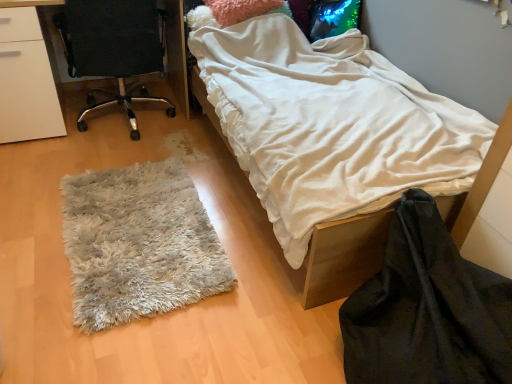
Question: Does white soft blanket at center appear on the right side of black velvet blanket at lower right?

Choices:
 (A) no
 (B) yes

Answer: (A)

Question: Is black velvet blanket at lower right completely or partially inside white soft blanket at center?

Choices:
 (A) no
 (B) yes

Answer: (A)

Question: Does white soft blanket at center have a lesser width compared to black velvet blanket at lower right?

Choices:
 (A) yes
 (B) no

Answer: (B)

Question: Is white soft blanket at center oriented away from black velvet blanket at lower right?

Choices:
 (A) yes
 (B) no

Answer: (B)

Question: Is white soft blanket at center taller than black velvet blanket at lower right?

Choices:
 (A) yes
 (B) no

Answer: (A)

Question: From a real-world perspective, is white soft blanket at center under black velvet blanket at lower right?

Choices:
 (A) yes
 (B) no

Answer: (B)

Question: Is white fluffy rug at lower left oriented away from white soft blanket at center?

Choices:
 (A) no
 (B) yes

Answer: (B)

Question: From the image's perspective, is white fluffy rug at lower left over white soft blanket at center?

Choices:
 (A) no
 (B) yes

Answer: (A)

Question: Can you confirm if white fluffy rug at lower left is bigger than white soft blanket at center?

Choices:
 (A) no
 (B) yes

Answer: (A)

Question: Considering the relative sizes of white fluffy rug at lower left and white soft blanket at center in the image provided, is white fluffy rug at lower left thinner than white soft blanket at center?

Choices:
 (A) no
 (B) yes

Answer: (B)

Question: Is white fluffy rug at lower left wider than white soft blanket at center?

Choices:
 (A) no
 (B) yes

Answer: (A)

Question: Is white fluffy rug at lower left in front of white soft blanket at center?

Choices:
 (A) no
 (B) yes

Answer: (A)

Question: Is white fluffy rug at lower left wider than black fabric chair at left?

Choices:
 (A) yes
 (B) no

Answer: (A)